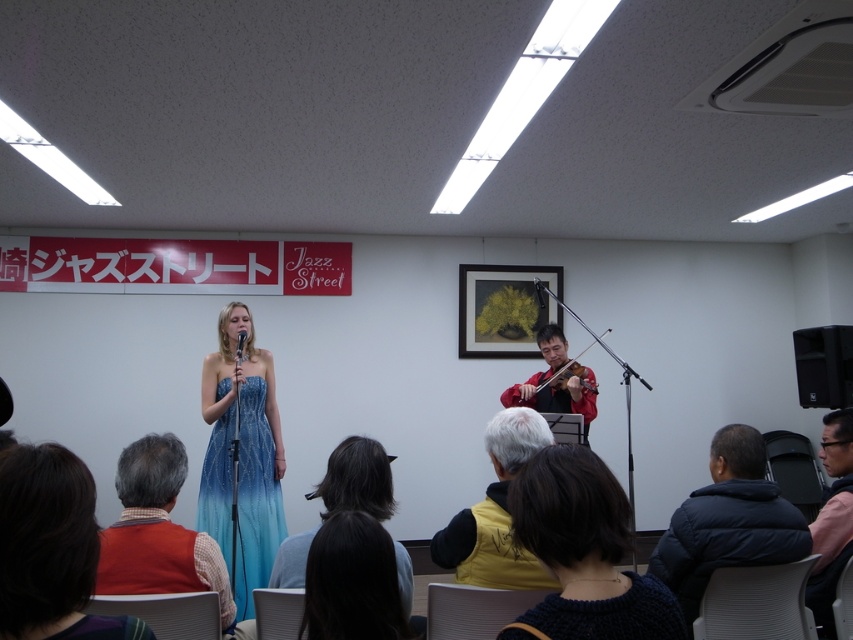
You are a photographer setting up a camera at the back of the room. You want to capture a close shot of both the dark brown hair at lower center and the yellow fabric vest at lower center in the same frame. Given that your camera has a maximum focus range of 16 inches, will you be able to achieve this?

The distance between the dark brown hair at lower center and the yellow fabric vest at lower center is 16.20 inches, which exceeds the camera maximum focus range of 16 inches. Therefore, you cannot capture both in the same frame with the current settings.

You are a photographer taking a picture of the dark brown hair at lower center and the yellow fabric vest at lower center. Which object will appear larger in your photo?

The dark brown hair at lower center will appear larger in the photo because it is closer to the viewer than the yellow fabric vest at lower center.